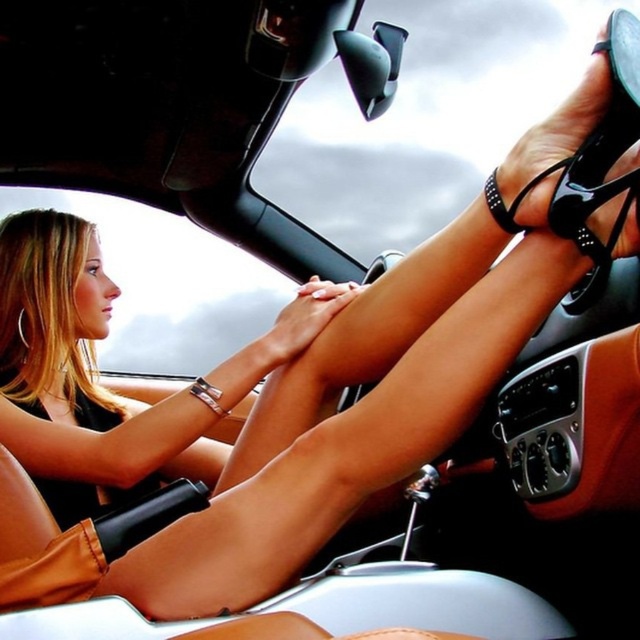
Which is behind, point (67, 468) or point (593, 170)?

Point (67, 468)

Can you confirm if smooth skin legs at center is positioned to the right of black glossy shoe at center?

No, smooth skin legs at center is not to the right of black glossy shoe at center.

Does point (317, 317) come closer to viewer compared to point (554, 163)?

No, it is not.

Find the location of a particular element. The image size is (640, 640). smooth skin legs at center is located at coordinates (97, 372).